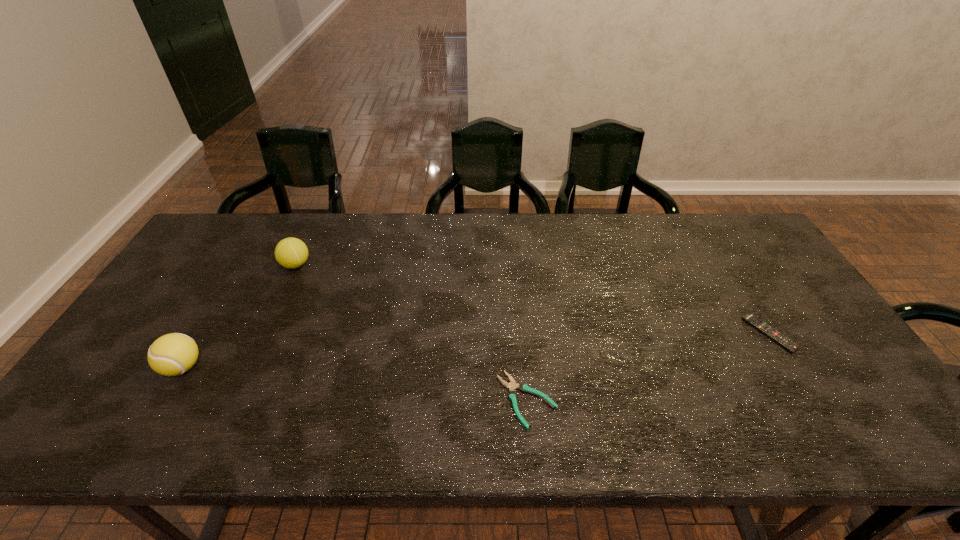
This screenshot has height=540, width=960. I want to click on the left tennis ball, so click(173, 354).

Locate an element on the screen. This screenshot has height=540, width=960. the leftmost object is located at coordinates (173, 354).

Identify the location of the farthest object. This screenshot has height=540, width=960. (291, 253).

Locate an element on the screen. the second object from left to right is located at coordinates (291, 253).

This screenshot has width=960, height=540. I want to click on the rightmost object, so click(763, 327).

Locate an element on the screen. The width and height of the screenshot is (960, 540). the third object from left to right is located at coordinates (512, 386).

Where is `free region located 0.310m on the back of the nearer tennis ball`? free region located 0.310m on the back of the nearer tennis ball is located at coordinates (240, 271).

Locate an element on the screen. The height and width of the screenshot is (540, 960). blank area located 0.270m on the left of the farthest object is located at coordinates (195, 265).

Locate an element on the screen. The width and height of the screenshot is (960, 540). vacant point located 0.240m on the back of the rightmost object is located at coordinates (723, 258).

Identify the location of free space located on the left of the pliers. The image size is (960, 540). (413, 400).